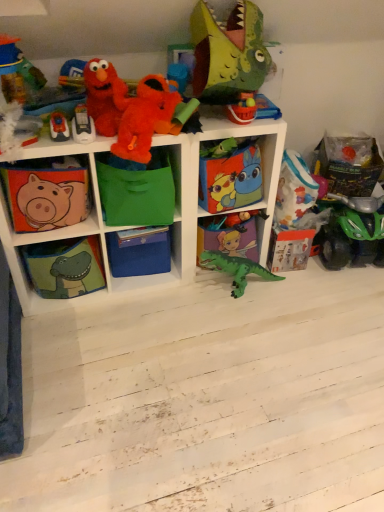
Locate an element on the screen. The image size is (384, 512). free space in front of green plastic dinosaur at center, which ranks as the 1th toy in bottom-to-top order is located at coordinates click(x=239, y=322).